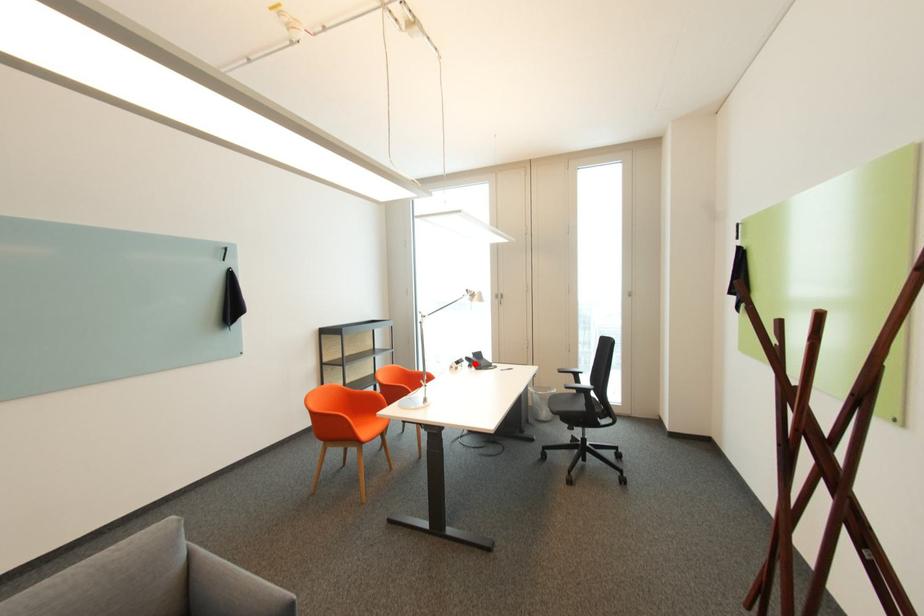
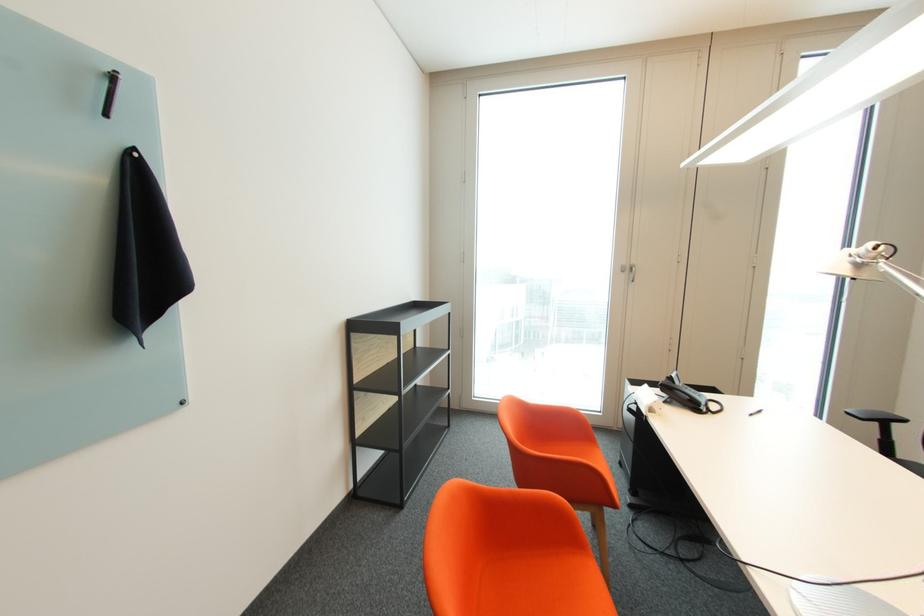
Where in the second image is the point corresponding to the highlighted location from the first image?

(673, 397)